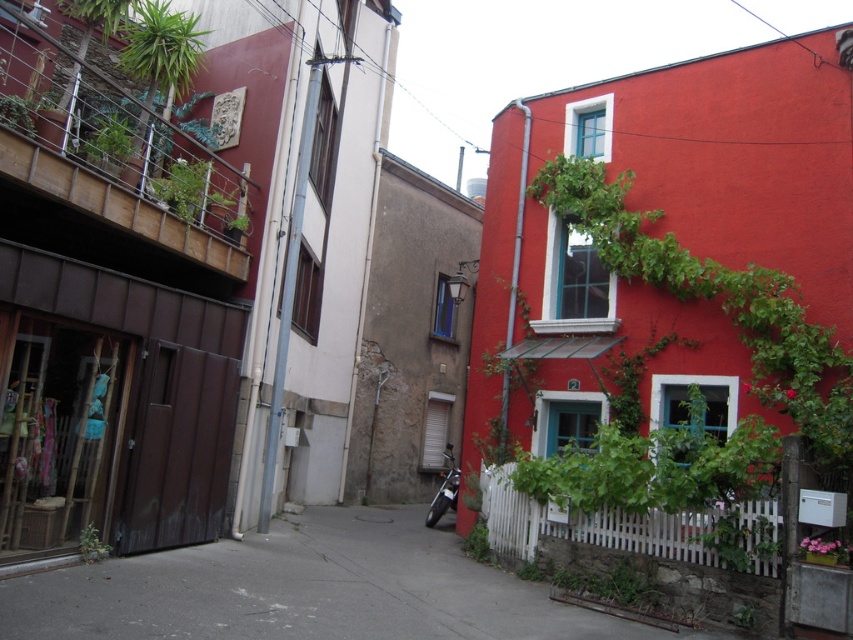
Between green leafy plant at upper left and green leafy plant at lower center, which one has more height?

Standing taller between the two is green leafy plant at upper left.

Between point (161, 204) and point (485, 531), which one is positioned in front?

Point (161, 204) is in front.

This screenshot has height=640, width=853. Identify the location of green leafy plant at upper left. (200, 195).

Can you confirm if gray concrete pavement at lower center is positioned to the left of green leafy plant at lower left?

Incorrect, gray concrete pavement at lower center is not on the left side of green leafy plant at lower left.

Is gray concrete pavement at lower center to the right of green leafy plant at lower left from the viewer's perspective?

Yes, gray concrete pavement at lower center is to the right of green leafy plant at lower left.

Identify the location of gray concrete pavement at lower center. tap(306, 589).

Between gray concrete pavement at lower center and green leafy plant at lower center, which one is positioned higher?

gray concrete pavement at lower center is higher up.

Is point (184, 593) positioned after point (480, 525)?

No, it is not.

The image size is (853, 640). In order to click on gray concrete pavement at lower center in this screenshot , I will do `click(306, 589)`.